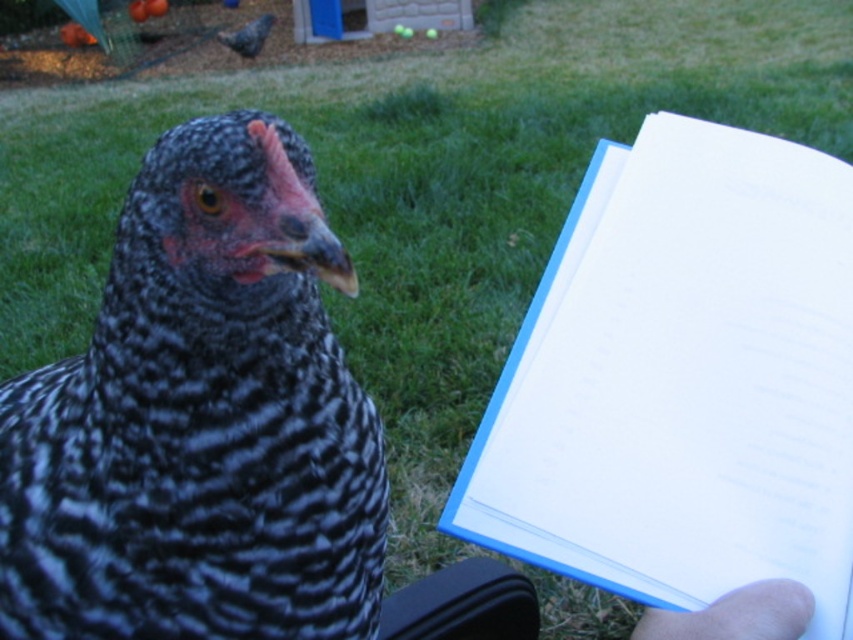
Is point (848, 516) in front of point (773, 582)?

No, it is behind (773, 582).

Describe the element at coordinates (682, 380) in the screenshot. I see `white paper at right` at that location.

Where is `white paper at right`? The width and height of the screenshot is (853, 640). white paper at right is located at coordinates (682, 380).

Who is positioned more to the right, speckled feathered chicken at center or white paper at right?

From the viewer's perspective, white paper at right appears more on the right side.

Is point (270, 476) less distant than point (611, 259)?

Yes, point (270, 476) is closer to viewer.

Does point (239, 326) lie behind point (793, 276)?

No, (239, 326) is in front of (793, 276).

You are a GUI agent. You are given a task and a screenshot of the screen. Output one action in this format:
    pyautogui.click(x=<x>, y=<y>)
    Task: Click on the speckled feathered chicken at center
    The width and height of the screenshot is (853, 640).
    Given the screenshot: What is the action you would take?
    pyautogui.click(x=200, y=420)

Can you confirm if speckled feathered chicken at center is shorter than smooth skin hand at lower right?

No.

Who is shorter, speckled feathered chicken at center or smooth skin hand at lower right?

smooth skin hand at lower right is shorter.

Is point (322, 476) positioned behind point (688, 632)?

That is True.

At what (x,y) coordinates should I click in order to perform the action: click on speckled feathered chicken at center. Please return your answer as a coordinate pair (x, y). Looking at the image, I should click on (200, 420).